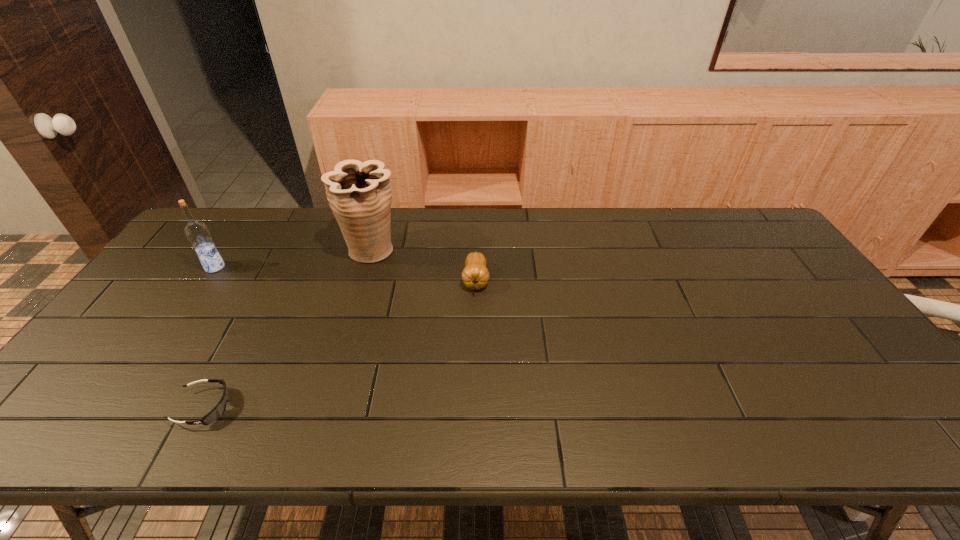
Locate an element on the screen. vacant space that's between the nearest object and the second shortest object is located at coordinates (340, 343).

Where is `vacant space that is in between the urn and the leftmost object`? This screenshot has width=960, height=540. vacant space that is in between the urn and the leftmost object is located at coordinates (293, 258).

Locate an element on the screen. free area in between the vodka and the third object from left to right is located at coordinates (293, 258).

Where is `free point between the urn and the rightmost object`? free point between the urn and the rightmost object is located at coordinates (423, 265).

You are a GUI agent. You are given a task and a screenshot of the screen. Output one action in this format:
    pyautogui.click(x=<x>, y=<y>)
    Task: Click on the free spot between the nearest object and the urn
    
    Given the screenshot: What is the action you would take?
    pyautogui.click(x=288, y=328)

Find the location of `blank region between the second shortest object and the second object from right to left`. blank region between the second shortest object and the second object from right to left is located at coordinates (423, 265).

The image size is (960, 540). Find the location of `vacant area between the goggles and the vodka`. vacant area between the goggles and the vodka is located at coordinates (209, 337).

Locate an element on the screen. free space between the urn and the shortest object is located at coordinates (288, 328).

Find the location of `free space between the vodka and the shortest object`. free space between the vodka and the shortest object is located at coordinates (209, 337).

You are a GUI agent. You are given a task and a screenshot of the screen. Output one action in this format:
    pyautogui.click(x=<x>, y=<y>)
    Task: Click on the free space between the urn and the leftmost object
    The image size is (960, 540).
    Given the screenshot: What is the action you would take?
    pyautogui.click(x=293, y=258)